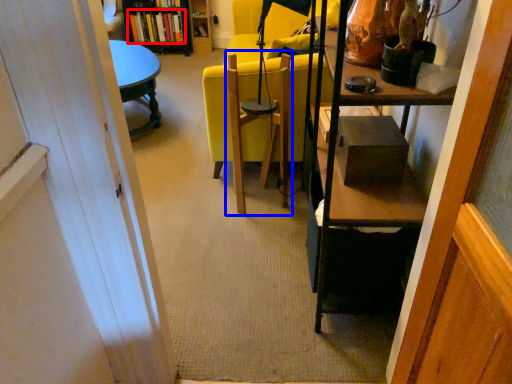
Question: Among these objects, which one is farthest to the camera, book (highlighted by a red box) or swivel chair (highlighted by a blue box)?

Choices:
 (A) book
 (B) swivel chair

Answer: (A)